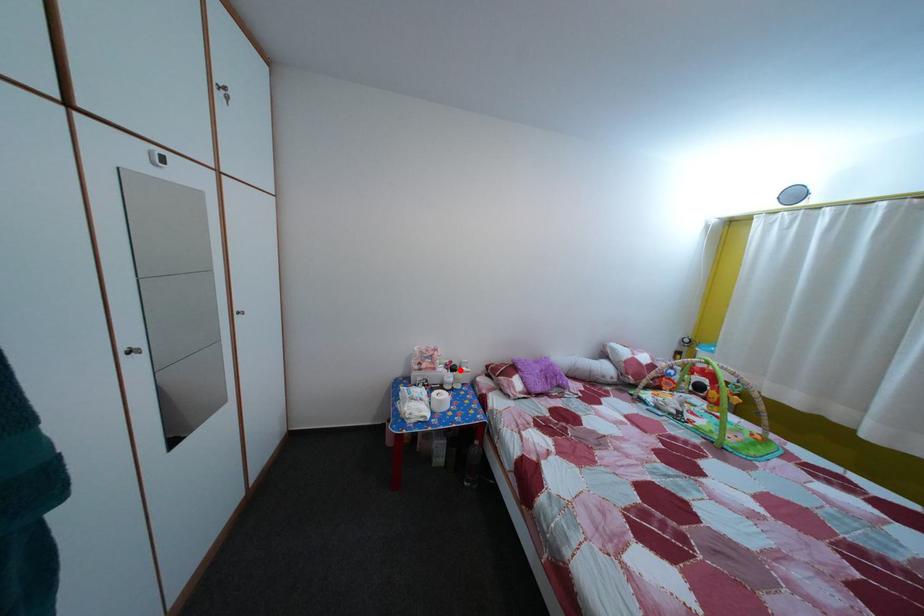
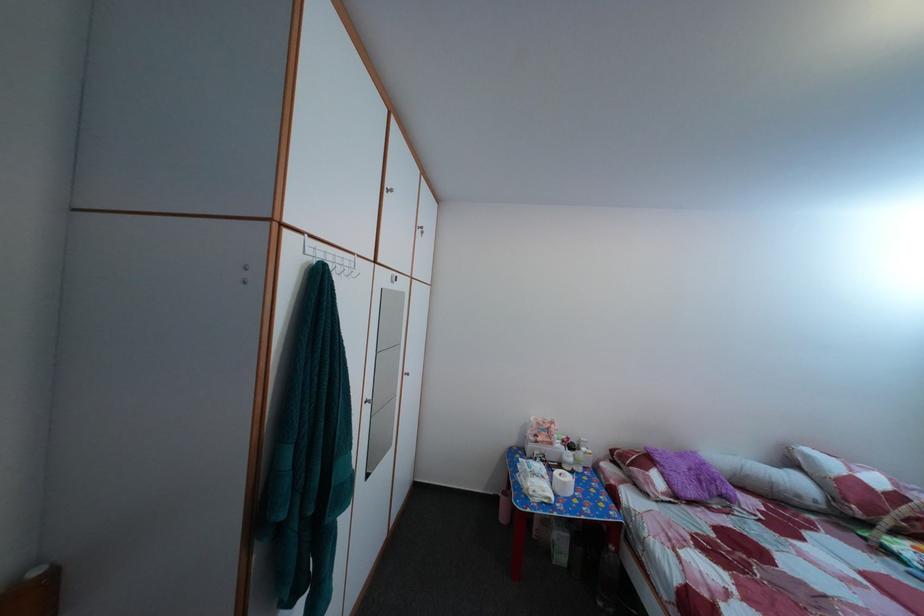
Question: I am providing you with two images of the same scene from different viewpoints. A red point is shown in image1. For the corresponding object point in image2, is it positioned nearer or farther from the camera?

Choices:
 (A) Nearer
 (B) Farther

Answer: (B)